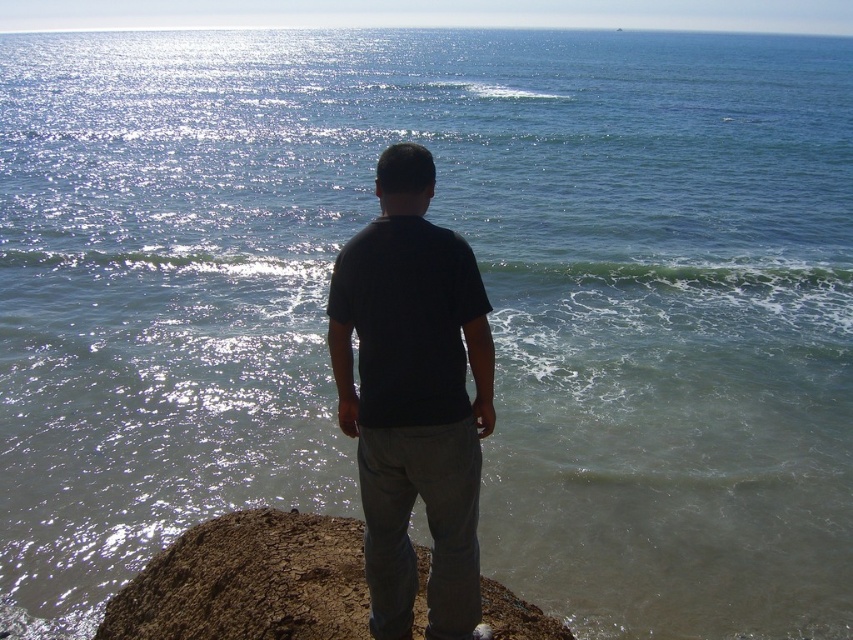
Question: Is dark matte shirt at center to the right of dull brown dirt at center from the viewer's perspective?

Choices:
 (A) yes
 (B) no

Answer: (A)

Question: Can you confirm if dark matte shirt at center is positioned to the right of dull brown dirt at center?

Choices:
 (A) yes
 (B) no

Answer: (A)

Question: Which object is closer to the camera taking this photo?

Choices:
 (A) dull brown dirt at center
 (B) dark matte shirt at center

Answer: (B)

Question: Can you confirm if dark matte shirt at center is positioned below dull brown dirt at center?

Choices:
 (A) no
 (B) yes

Answer: (A)

Question: Among these objects, which one is farthest from the camera?

Choices:
 (A) dull brown dirt at center
 (B) dark matte shirt at center

Answer: (A)